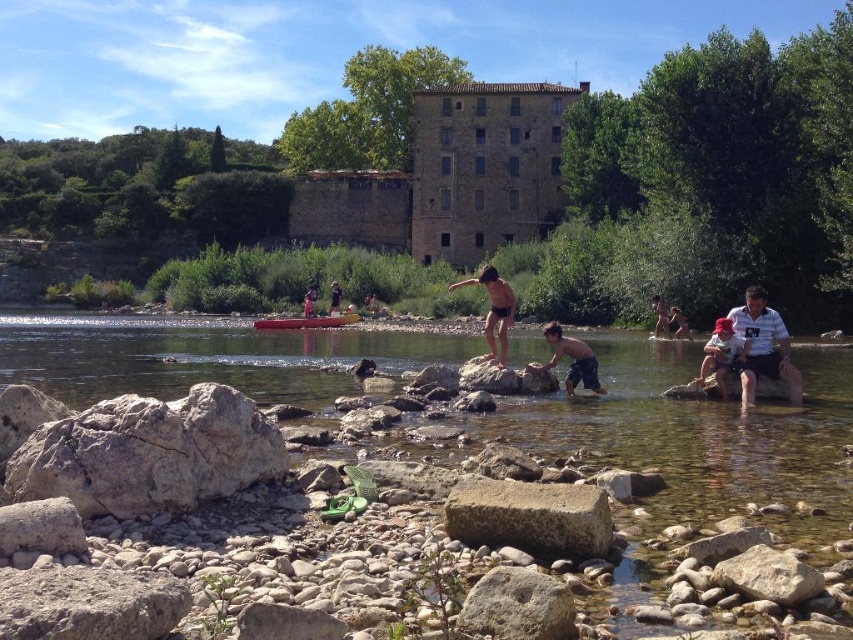
Looking at this image, you are standing at the center of the riverbank and want to hand a life jacket to the person wearing the white striped shirt at right and the matte pink hat at lower right. Which person is closer to you?

The white striped shirt at right is 4.93 feet away from matte pink hat at lower right. Since the question asks which is closer to you, but the distance between them is given, not their individual distances from you, the answer cannot be determined with the provided information.

In the scene shown: You are standing at the origin point of the image coordinate system. You want to locate the matte black shorts at center. In which direction should you move relative to your current position?

The matte black shorts at center is located at coordinate point 0.486 on the x axis and 0.579 on the y axis. Since the origin is at the bottom left corner of the image, moving towards the right along the x axis and upwards along the y axis from the origin will reach the position of the matte black shorts at center.

You are a photographer trying to capture the scene of the matte black shorts at center and the smooth plastic boat at center. Which object appears narrower in the photo?

The matte black shorts at center appears narrower than the smooth plastic boat at center in the photo.